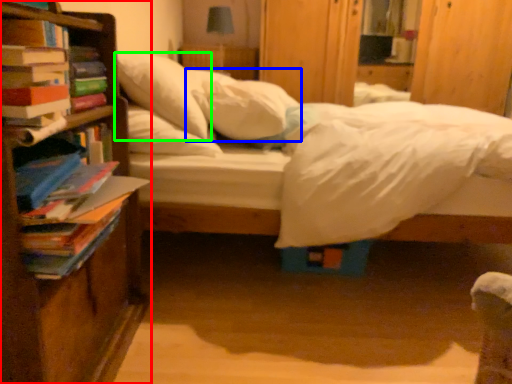
Question: Which object is the closest to the bookcase (highlighted by a red box)? Choose among these: pillow (highlighted by a blue box) or pillow (highlighted by a green box).

Choices:
 (A) pillow
 (B) pillow

Answer: (B)